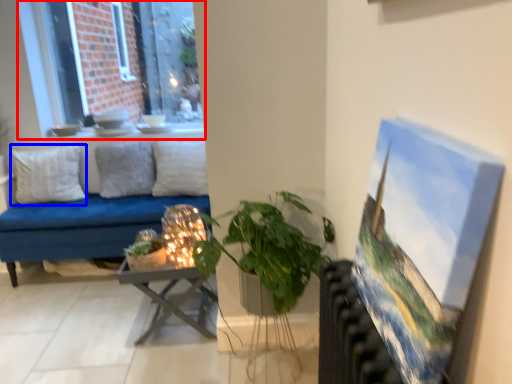
Question: Which object is closer to the camera taking this photo, window (highlighted by a red box) or pillow (highlighted by a blue box)?

Choices:
 (A) window
 (B) pillow

Answer: (B)